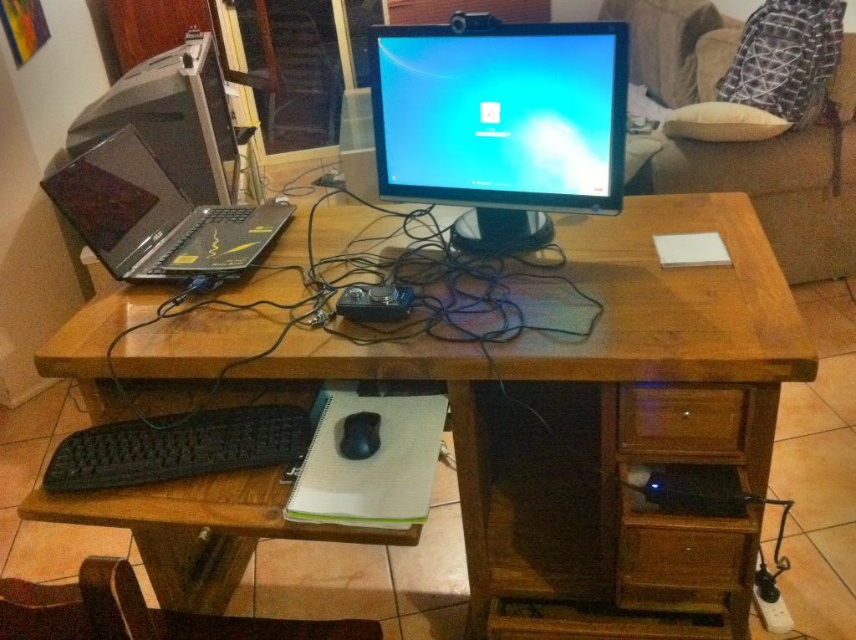
Question: Estimate the real-world distances between objects in this image. Which object is closer to the satin black monitor at center?

Choices:
 (A) matte black laptop at left
 (B) black matte keyboard at lower left
 (C) wooden drawer at lower right
 (D) wooden computer desk at center

Answer: (D)

Question: Can you confirm if wooden computer desk at center is wider than wooden drawer at lower right?

Choices:
 (A) no
 (B) yes

Answer: (B)

Question: Can you confirm if matte black laptop at left is positioned to the left of wooden drawer at lower right?

Choices:
 (A) yes
 (B) no

Answer: (A)

Question: Which point is closer to the camera?

Choices:
 (A) black matte mouse at lower center
 (B) brown wood drawer at lower right
 (C) wooden drawer at lower right

Answer: (B)

Question: Which of the following is the farthest from the observer?

Choices:
 (A) (688, 541)
 (B) (111, 454)

Answer: (A)

Question: Where is wooden computer desk at center located in relation to wooden drawer at lower right in the image?

Choices:
 (A) left
 (B) right

Answer: (A)